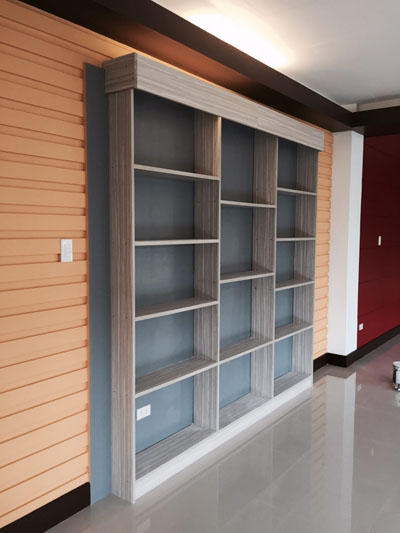
Find the location of a particular element. gray tile floor is located at coordinates (325, 480).